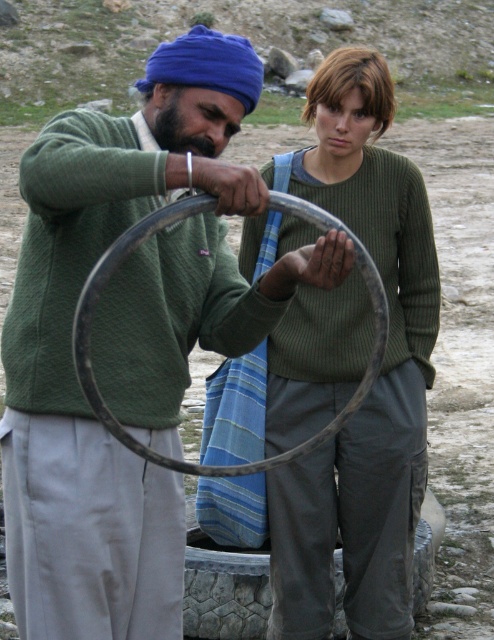
Between green ribbed sweater at center and metallic silver hula hoop at center, which one appears on the right side from the viewer's perspective?

green ribbed sweater at center is more to the right.

Does green ribbed sweater at center have a greater height compared to metallic silver hula hoop at center?

Yes, green ribbed sweater at center is taller than metallic silver hula hoop at center.

Is point (322, 81) more distant than point (136, 445)?

Yes.

In order to click on green ribbed sweater at center in this screenshot , I will do `click(373, 385)`.